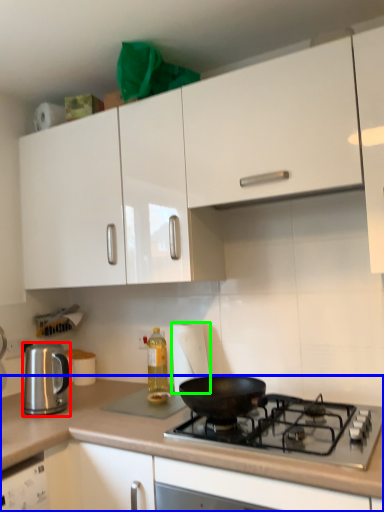
Question: Which object is positioned closest to kitchen appliance (highlighted by a red box)? Select from countertop (highlighted by a blue box) and paper towel (highlighted by a green box).

Choices:
 (A) countertop
 (B) paper towel

Answer: (A)